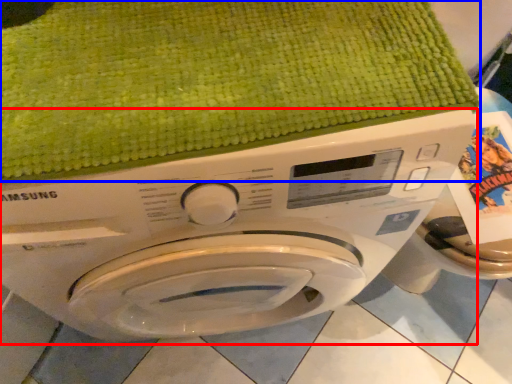
Question: Which object appears farthest to the camera in this image, washing machine (highlighted by a red box) or bath towel (highlighted by a blue box)?

Choices:
 (A) washing machine
 (B) bath towel

Answer: (B)